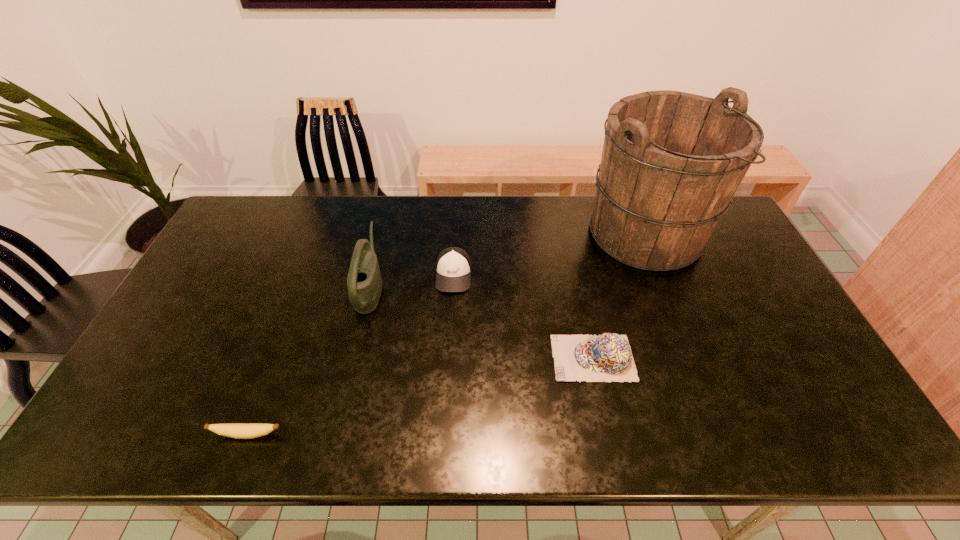
The image size is (960, 540). In order to click on bucket in this screenshot , I will do `click(672, 161)`.

Locate an element on the screen. The width and height of the screenshot is (960, 540). the fourth shortest object is located at coordinates (364, 281).

This screenshot has width=960, height=540. Find the location of `the second object from left to right`. the second object from left to right is located at coordinates (364, 281).

Where is `the farther cap`? The width and height of the screenshot is (960, 540). the farther cap is located at coordinates click(453, 266).

Where is `the third object from left to right`? The image size is (960, 540). the third object from left to right is located at coordinates (453, 266).

Image resolution: width=960 pixels, height=540 pixels. What are the coordinates of `the fourth farthest object` in the screenshot? It's located at tap(608, 357).

Where is `the nearer cap`? Image resolution: width=960 pixels, height=540 pixels. the nearer cap is located at coordinates (608, 357).

This screenshot has height=540, width=960. What are the coordinates of `banana` in the screenshot? It's located at (234, 430).

Identify the location of the leftmost object. This screenshot has height=540, width=960. (234, 430).

Identify the location of free space located on the front of the tallest object. This screenshot has height=540, width=960. (669, 294).